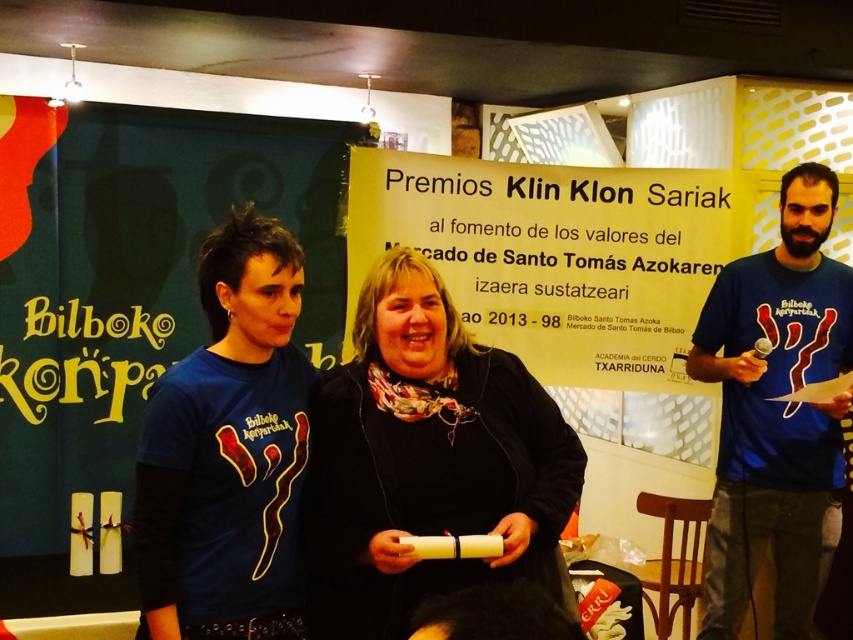
Question: Can you confirm if matte blue t-shirt at left is thinner than blue cotton t-shirt at right?

Choices:
 (A) no
 (B) yes

Answer: (B)

Question: Which point is farther from the camera taking this photo?

Choices:
 (A) (378, 560)
 (B) (825, 499)
 (C) (144, 448)

Answer: (B)

Question: Is matte blue t-shirt at left further to camera compared to blue cotton t-shirt at right?

Choices:
 (A) yes
 (B) no

Answer: (B)

Question: Which object is closer to the camera taking this photo?

Choices:
 (A) blue cotton t-shirt at right
 (B) matte blue t-shirt at left
 (C) black matte scarf at center

Answer: (C)

Question: Which point is farther to the camera?

Choices:
 (A) matte blue t-shirt at left
 (B) black matte scarf at center

Answer: (A)

Question: Is matte blue t-shirt at left above blue cotton t-shirt at right?

Choices:
 (A) yes
 (B) no

Answer: (A)